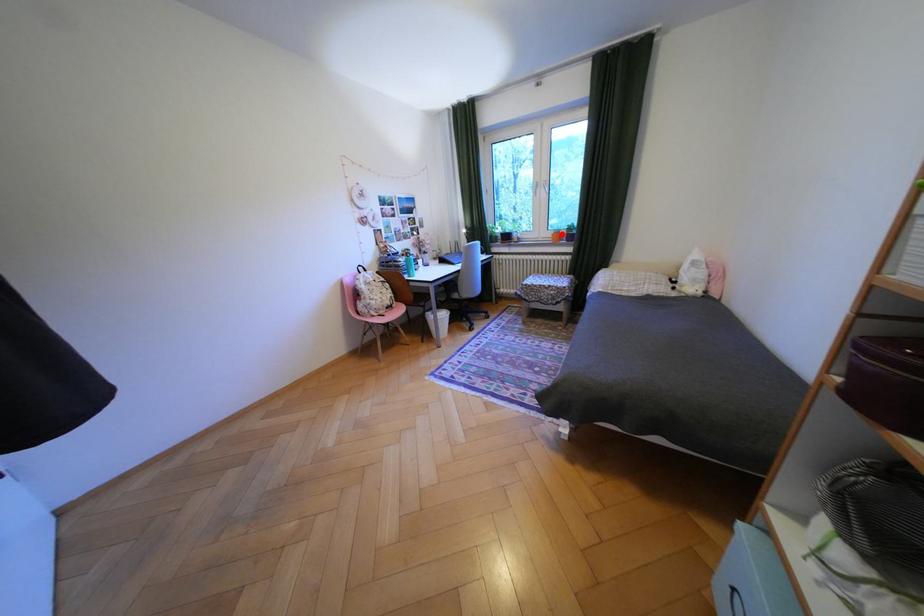
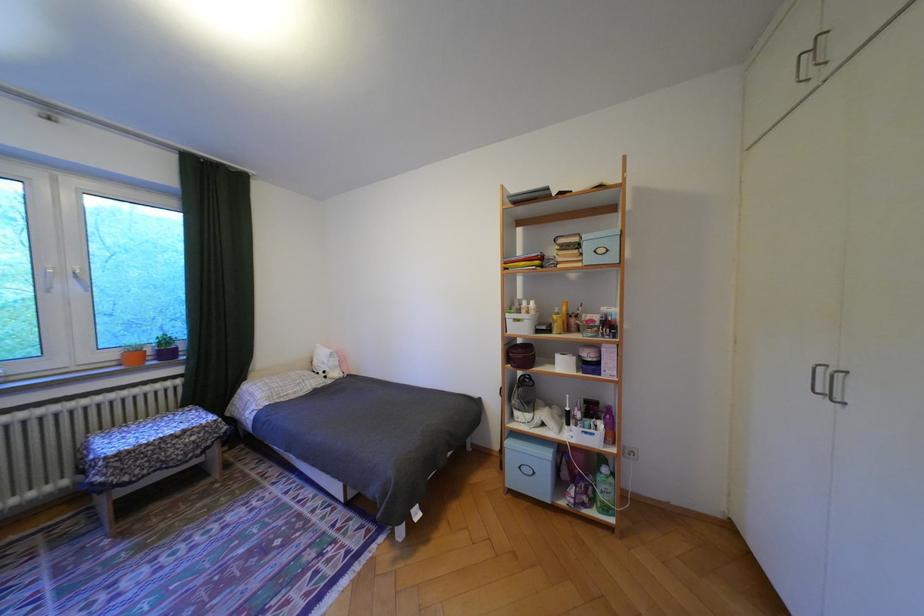
Question: I am providing you with two images of the same scene from different viewpoints. Image1 has a red point marked. In image2, the corresponding 3D location appears at what relative position? Reply with the corresponding letter.

Choices:
 (A) Closer
 (B) Farther

Answer: (B)